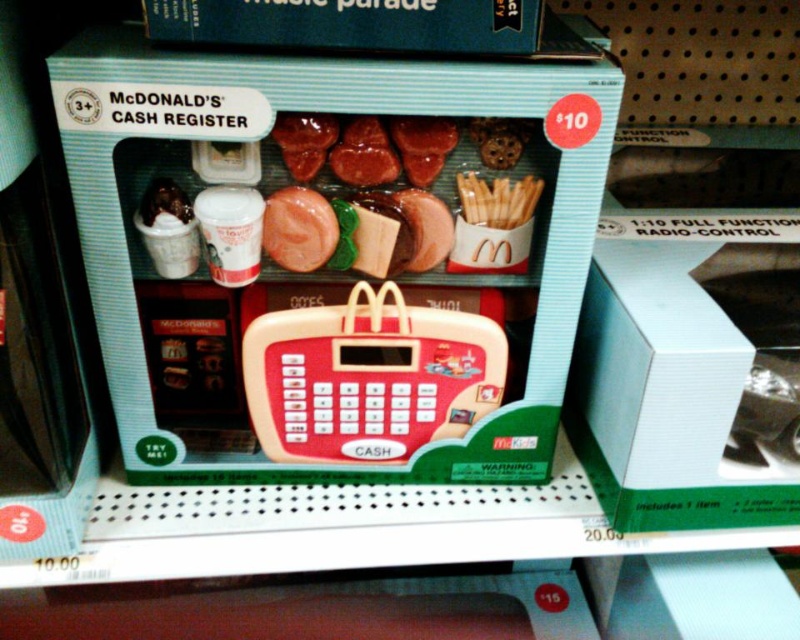
Question: Which point is farther to the camera?

Choices:
 (A) white cardboard box at right
 (B) shiny chocolate bar at center

Answer: (B)

Question: Is pink rubber toy at center positioned before golden crispy fries at center?

Choices:
 (A) yes
 (B) no

Answer: (A)

Question: Among these points, which one is farthest from the camera?

Choices:
 (A) (434, 116)
 (B) (288, 426)
 (C) (620, 256)

Answer: (B)

Question: Can you confirm if rubberized plastic cash register at center is positioned below pink rubber toy at center?

Choices:
 (A) yes
 (B) no

Answer: (A)

Question: Where is matte plastic toy cash register at center located in relation to blue cardboard box at upper center in the image?

Choices:
 (A) right
 (B) left

Answer: (B)

Question: Which point is farther to the camera?

Choices:
 (A) matte plastic toy cash register at center
 (B) blue cardboard box at upper center
 (C) golden crispy fries at center
 (D) rubberized plastic cash register at center

Answer: (D)